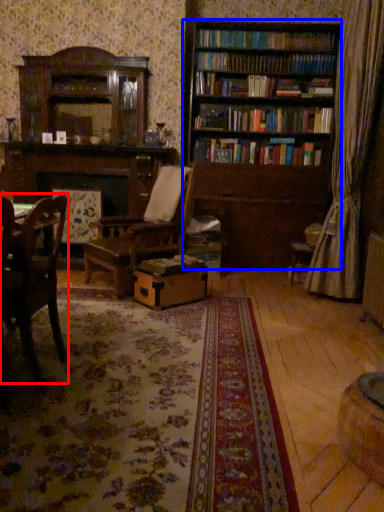
Question: Which object is closer to the camera taking this photo, chair (highlighted by a red box) or bookcase (highlighted by a blue box)?

Choices:
 (A) chair
 (B) bookcase

Answer: (A)